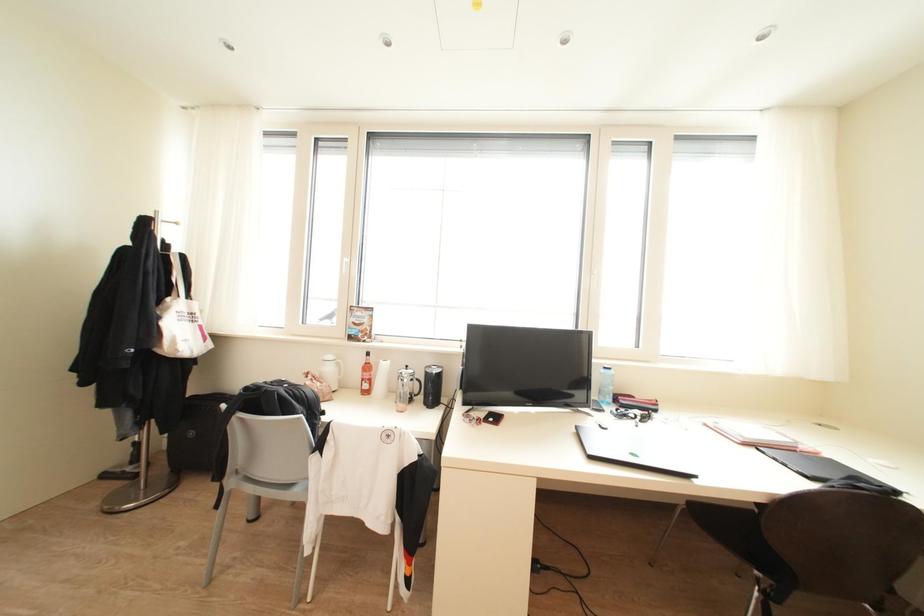
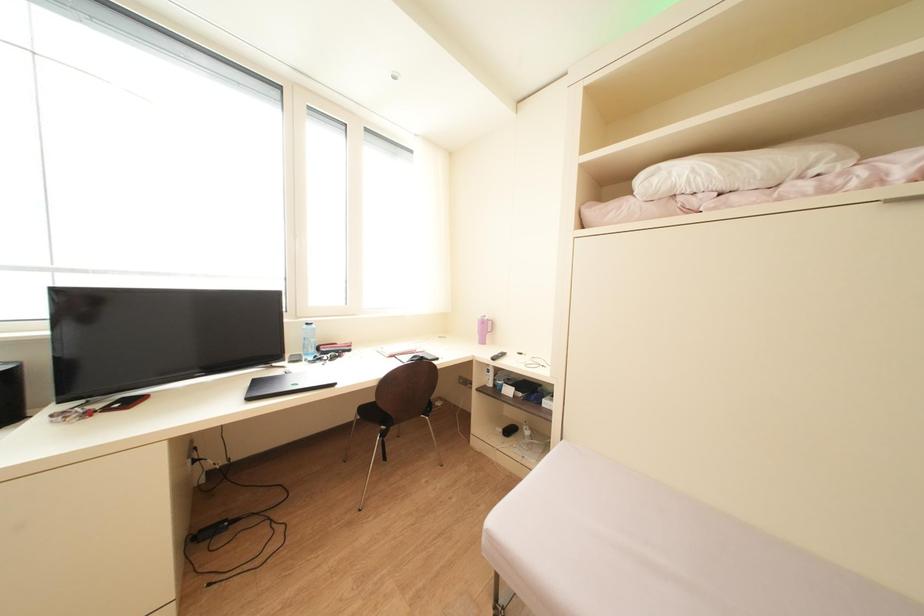
Question: The images are taken continuously from a first-person perspective. In which direction is your viewpoint rotating?

Choices:
 (A) Left
 (B) Right
 (C) Up
 (D) Down

Answer: (B)